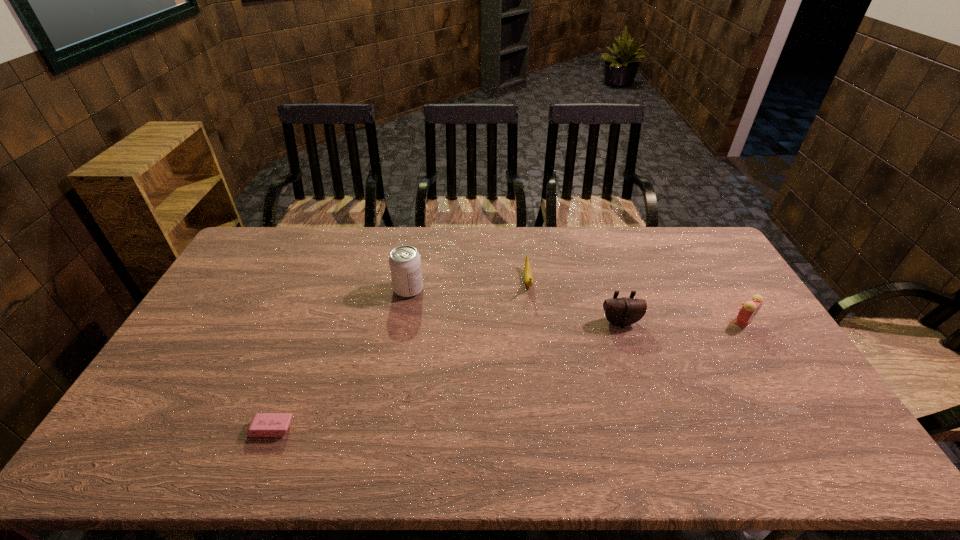
Find the location of a particular element. The height and width of the screenshot is (540, 960). free spot located on the face of the rightmost object is located at coordinates (780, 382).

The width and height of the screenshot is (960, 540). What are the coordinates of `vacant area situated 0.250m at the stem of the third object from right to left` in the screenshot? It's located at (538, 357).

The width and height of the screenshot is (960, 540). I want to click on free spot located on the left of the nearest object, so click(227, 429).

You are a GUI agent. You are given a task and a screenshot of the screen. Output one action in this format:
    pyautogui.click(x=<x>, y=<y>)
    Task: Click on the object at the far edge
    
    Given the screenshot: What is the action you would take?
    pyautogui.click(x=528, y=278)

This screenshot has height=540, width=960. I want to click on object present at the near edge, so click(x=263, y=424).

Identify the location of object located at the right edge. The height and width of the screenshot is (540, 960). (748, 311).

Locate an element on the screen. The image size is (960, 540). vacant space at the far edge is located at coordinates (506, 258).

At what (x,y) coordinates should I click in order to perform the action: click on free space at the near edge. Please return your answer as a coordinate pair (x, y). The height and width of the screenshot is (540, 960). Looking at the image, I should click on (540, 458).

Where is `free location at the left edge of the desktop`? Image resolution: width=960 pixels, height=540 pixels. free location at the left edge of the desktop is located at coordinates (189, 341).

Image resolution: width=960 pixels, height=540 pixels. I want to click on blank space at the right edge of the desktop, so 742,296.